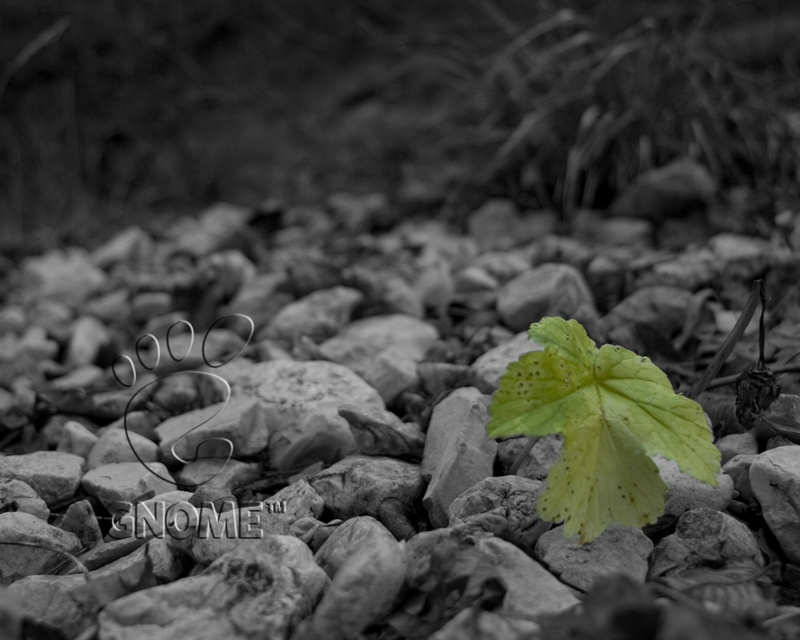
Does smooth gray rock at center have a lesser height compared to green matte leaf at center?

No.

Is point (512, 608) positioned before point (705, 445)?

Yes, point (512, 608) is closer to viewer.

The image size is (800, 640). What are the coordinates of `smooth gray rock at center` in the screenshot? It's located at (393, 444).